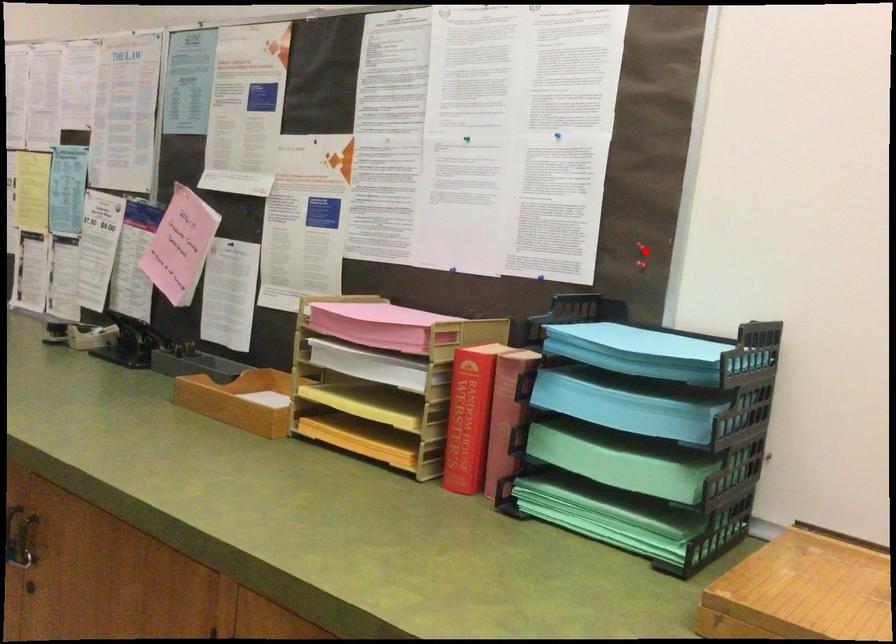
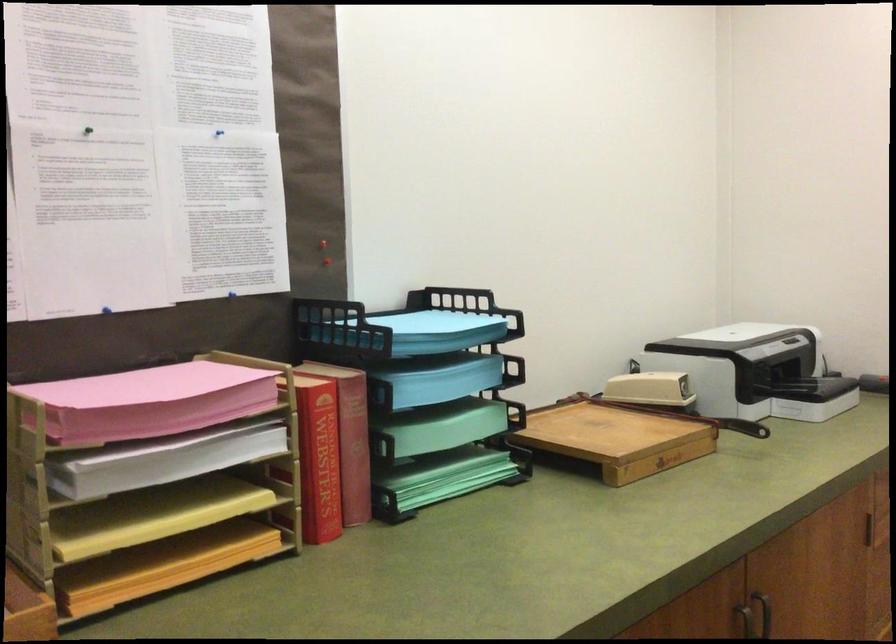
Where in the second image is the point corresponding to the highlighted location from the first image?

(323, 252)